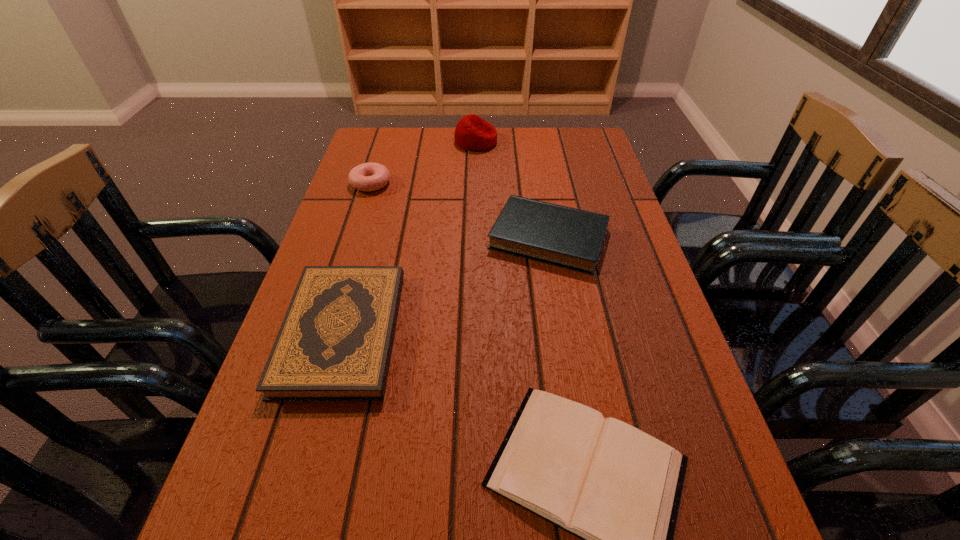
What are the coordinates of `doughnut located at the left edge` in the screenshot? It's located at (367, 177).

The height and width of the screenshot is (540, 960). In order to click on hardback book located at the left edge in this screenshot , I will do `click(335, 342)`.

This screenshot has height=540, width=960. What are the coordinates of `object that is at the right edge` in the screenshot? It's located at (571, 238).

You are a GUI agent. You are given a task and a screenshot of the screen. Output one action in this format:
    pyautogui.click(x=<x>, y=<y>)
    Task: Click on the vacant space at the far edge of the desktop
    This screenshot has height=540, width=960.
    Given the screenshot: What is the action you would take?
    pyautogui.click(x=448, y=140)

In the image, there is a desktop. Where is `free space at the left edge`? The image size is (960, 540). free space at the left edge is located at coordinates (379, 207).

In the image, there is a desktop. At what (x,y) coordinates should I click in order to perform the action: click on vacant space at the right edge. Please return your answer as a coordinate pair (x, y). The height and width of the screenshot is (540, 960). Looking at the image, I should click on (656, 334).

I want to click on blank space at the far right corner of the desktop, so click(556, 160).

What are the coordinates of `empty location between the beanbag and the leftmost hardback book` in the screenshot? It's located at (409, 237).

Where is `unoccupied area between the tallest object and the third nearest object`? The width and height of the screenshot is (960, 540). unoccupied area between the tallest object and the third nearest object is located at coordinates (512, 190).

This screenshot has height=540, width=960. I want to click on vacant region between the farthest hardback book and the fourth nearest object, so click(x=460, y=211).